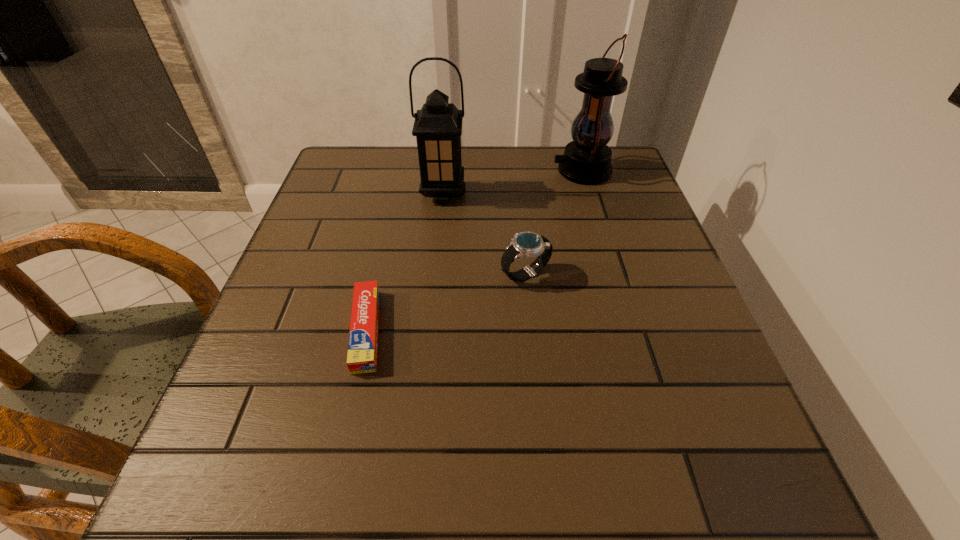
Choose which object is the third nearest neighbor to the nearest object. Please provide its 2D coordinates. Your answer should be formatted as a tuple, i.e. [(x, y)], where the tuple contains the x and y coordinates of a point satisfying the conditions above.

[(587, 159)]

Image resolution: width=960 pixels, height=540 pixels. What are the coordinates of `free location that satisfies the following two spatial constraints: 1. above the rightmost object, indicating its light source; 2. on the front side of the left lantern` in the screenshot? It's located at (589, 193).

This screenshot has width=960, height=540. Find the location of `free location that satisfies the following two spatial constraints: 1. above the rightmost object, indicating its light source; 2. on the front side of the leftmost object`. free location that satisfies the following two spatial constraints: 1. above the rightmost object, indicating its light source; 2. on the front side of the leftmost object is located at coordinates (631, 330).

Locate an element on the screen. free space that satisfies the following two spatial constraints: 1. above the rightmost object, indicating its light source; 2. on the front side of the shortest object is located at coordinates (631, 330).